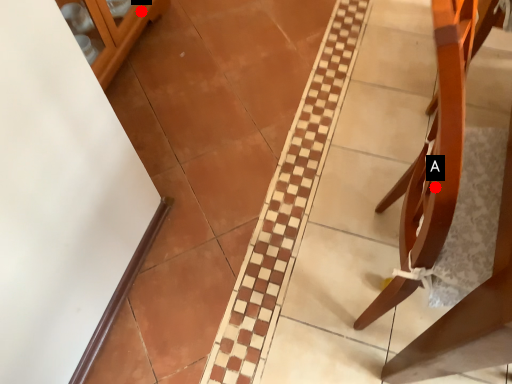
Question: Two points are circled on the image, labeled by A and B beside each circle. Which point is closer to the camera?

Choices:
 (A) A is closer
 (B) B is closer

Answer: (A)